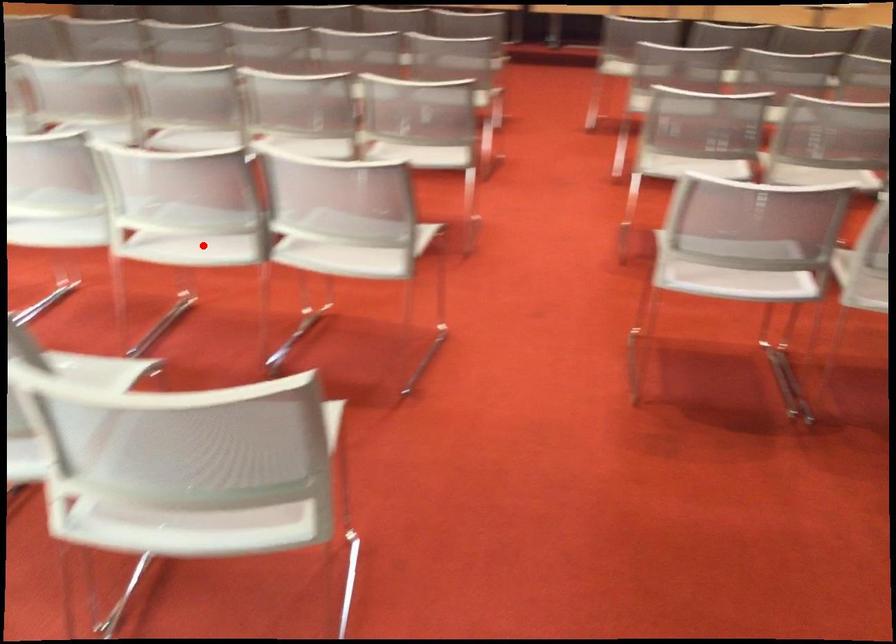
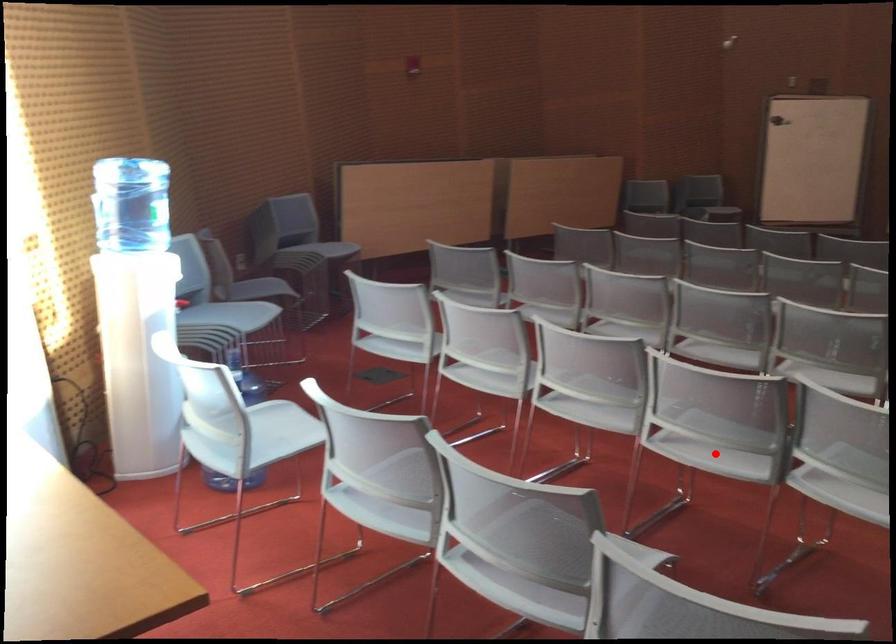
I am providing you with two images of the same scene from different viewpoints. A red point is marked on the first image and another point is marked on the second image. Is the red point in image1 aligned with the point shown in image2?

Yes